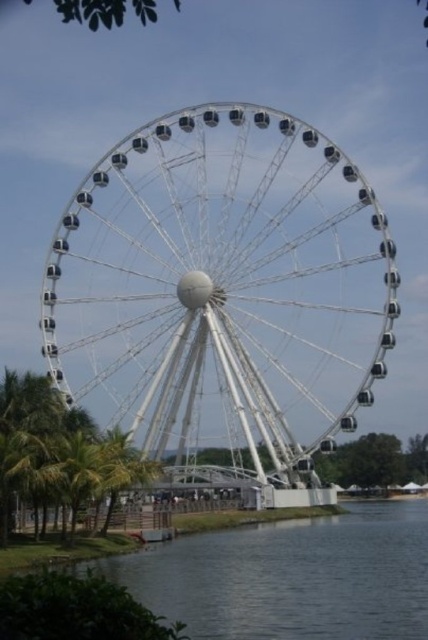
From the picture: You are standing at the shoreline and want to walk from the green leafy tree at lower left to the green leafy palm tree at lower left. Which direction should you face to walk directly towards the palm tree?

You should face away from the Ferris wheel because the green leafy palm tree at lower left is further away from you than the green leafy tree at lower left, meaning it is behind the tree from your perspective.

You are standing on the shore of the lake and want to take a photo that includes both the white metallic ferris wheel at center and the green leafy tree at lower left. Based on their positions, which object should you position to your left side to include both in the frame?

The green leafy tree at lower left is to the left of the white metallic ferris wheel at center, so you should position the green leafy tree at lower left to your left side and the white metallic ferris wheel at center to your right side to include both in the frame.